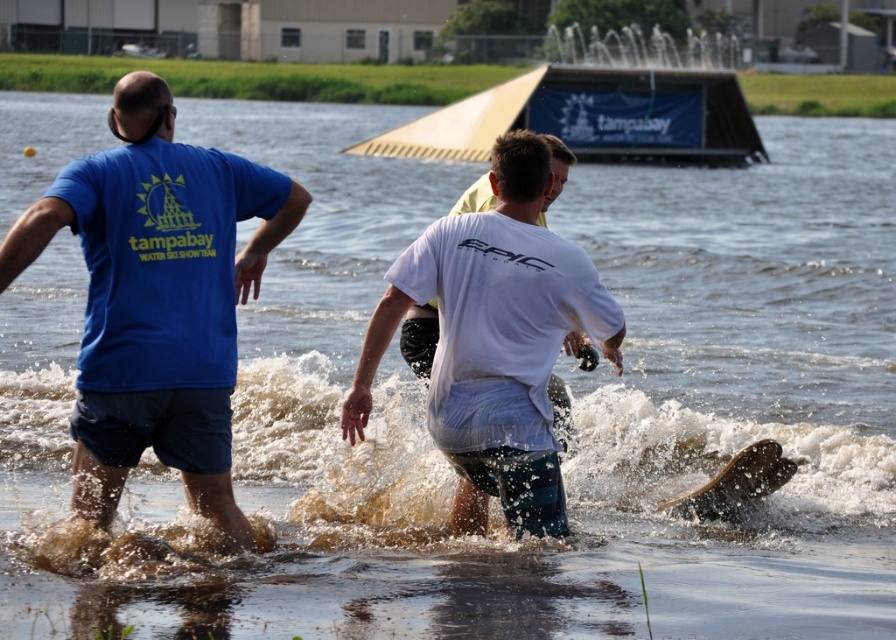
Can you confirm if blue cotton t-shirt at upper left is positioned to the right of white cotton shirt at center?

Incorrect, blue cotton t-shirt at upper left is not on the right side of white cotton shirt at center.

Based on the photo, can you confirm if blue cotton t-shirt at upper left is positioned below white cotton shirt at center?

No, blue cotton t-shirt at upper left is not below white cotton shirt at center.

Who is more distant from viewer, (x=95, y=248) or (x=487, y=282)?

Positioned behind is point (x=487, y=282).

Locate an element on the screen. blue cotton t-shirt at upper left is located at coordinates (157, 298).